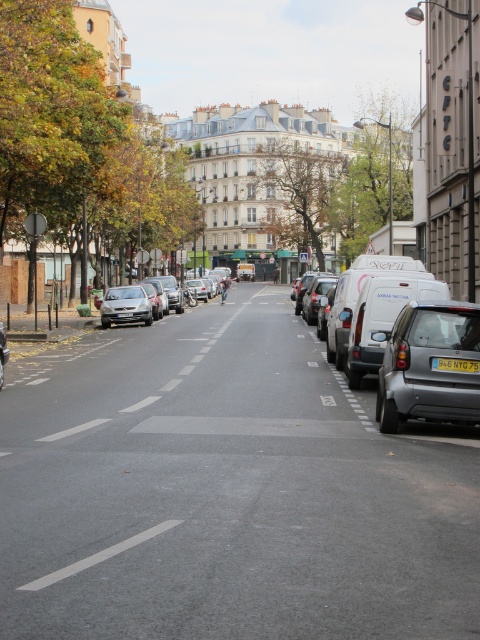
You are standing on the quiet urban street scene and want to walk from the point at coordinates point (146, 301) to the point at coordinates point (458, 362). Which direction should you face to walk towards your destination?

Since point (146, 301) is behind point (458, 362), you should face forward to walk towards your destination.